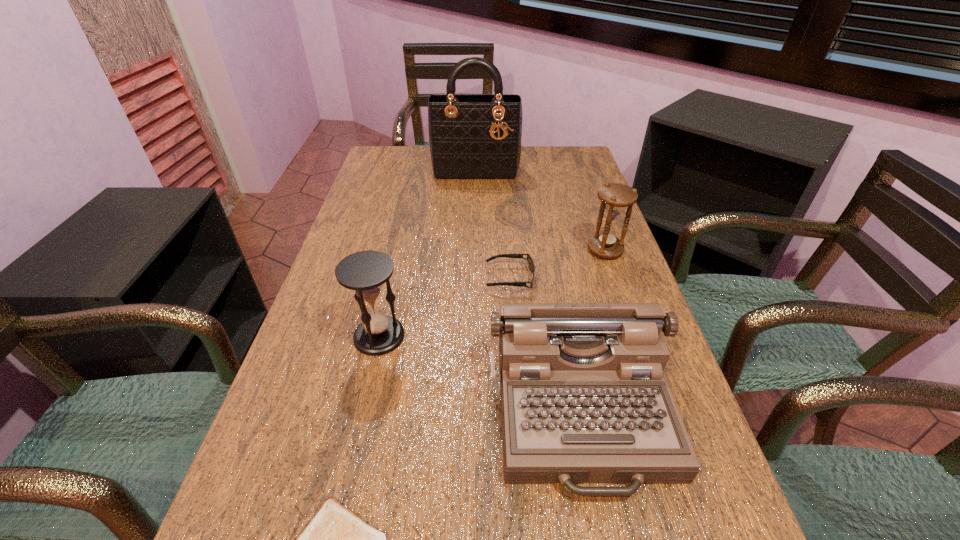
Find the location of a particular element. This screenshot has height=540, width=960. vacant region located on the back of the right hourglass is located at coordinates (594, 219).

Where is `vacant area situated on the keyboard of the typewriter`? The width and height of the screenshot is (960, 540). vacant area situated on the keyboard of the typewriter is located at coordinates (608, 539).

Locate an element on the screen. free spot located 0.270m on the front-facing side of the fourth nearest object is located at coordinates (376, 279).

Find the location of `vacant space located on the front-facing side of the fourth nearest object`. vacant space located on the front-facing side of the fourth nearest object is located at coordinates pyautogui.click(x=404, y=279).

Locate an element on the screen. The height and width of the screenshot is (540, 960). blank space located on the front-facing side of the fourth nearest object is located at coordinates (351, 279).

Find the location of `object located in the far edge section of the desktop`. object located in the far edge section of the desktop is located at coordinates (474, 137).

Find the location of a particular element. This screenshot has width=960, height=540. object located in the left edge section of the desktop is located at coordinates (365, 272).

This screenshot has height=540, width=960. Find the location of `hourglass present at the right edge`. hourglass present at the right edge is located at coordinates (615, 197).

Locate an element on the screen. The width and height of the screenshot is (960, 540). typewriter located in the right edge section of the desktop is located at coordinates (584, 398).

The image size is (960, 540). Identify the location of free region at the far edge of the desktop. (430, 171).